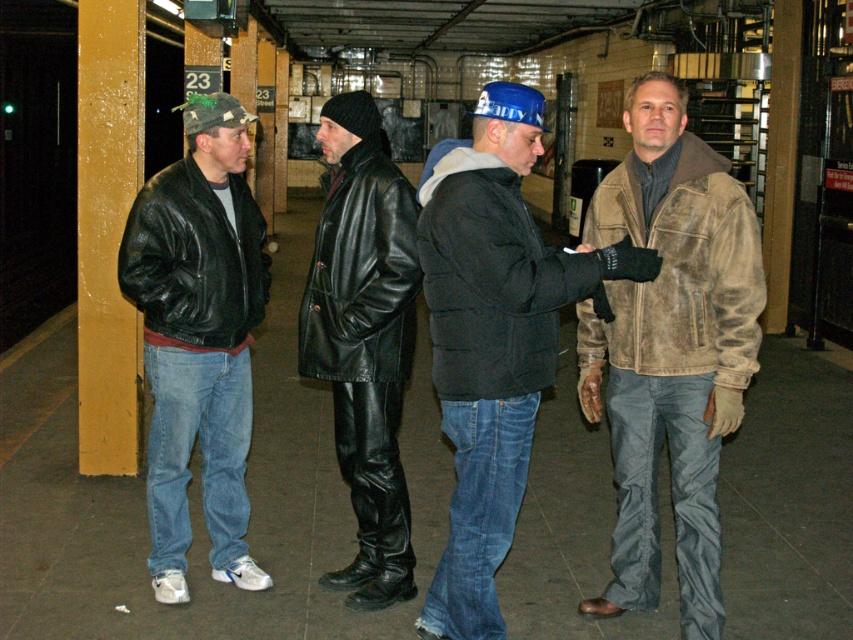
Question: Which point is farther to the camera?

Choices:
 (A) (312, 314)
 (B) (486, 428)
 (C) (397, 307)

Answer: (A)

Question: Does leather jacket at center have a lesser width compared to dark brown leather jacket at center?

Choices:
 (A) no
 (B) yes

Answer: (B)

Question: Which point is closer to the camera?

Choices:
 (A) dark brown leather jacket at center
 (B) matte black leather jacket at left

Answer: (A)

Question: Is matte black leather jacket at left bigger than black leather jacket at left?

Choices:
 (A) yes
 (B) no

Answer: (A)

Question: Among these objects, which one is farthest from the camera?

Choices:
 (A) black leather jacket at center
 (B) black leather jacket at left
 (C) shiny black leather jacket at center

Answer: (C)

Question: Is black puffy jacket at center below black leather jacket at center?

Choices:
 (A) yes
 (B) no

Answer: (A)